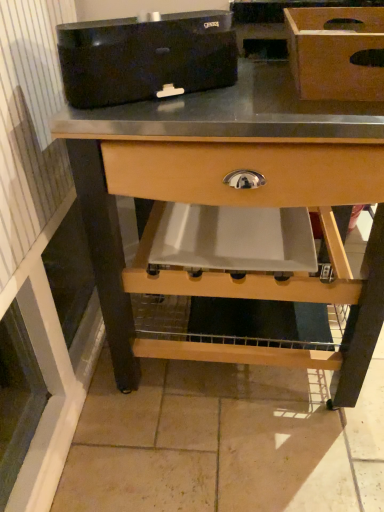
Measure the distance between black plastic toaster at upper center and camera.

black plastic toaster at upper center is 28.30 inches away from camera.

The height and width of the screenshot is (512, 384). Find the location of `black plastic toaster at upper center`. black plastic toaster at upper center is located at coordinates (146, 57).

You are a GUI agent. You are given a task and a screenshot of the screen. Output one action in this format:
    pyautogui.click(x=<x>, y=<y>)
    Task: Click on the wooden box at upper right
    
    Given the screenshot: What is the action you would take?
    [x=335, y=52]

From a real-world perspective, does black plastic toaster at upper center sit lower than wooden box at upper right?

Indeed, from a real-world perspective, black plastic toaster at upper center is positioned beneath wooden box at upper right.

Considering the points (64, 79) and (369, 11), which point is in front, point (64, 79) or point (369, 11)?

The point (64, 79) is closer to the camera.

Could you tell me if black plastic toaster at upper center is facing wooden box at upper right?

No, black plastic toaster at upper center is not turned towards wooden box at upper right.

Is black plastic toaster at upper center thinner than wooden box at upper right?

Correct, the width of black plastic toaster at upper center is less than that of wooden box at upper right.

Does wooden box at upper right lie behind black plastic toaster at upper center?

Yes, it is.

Can you confirm if wooden box at upper right is positioned to the left of black plastic toaster at upper center?

No.

In terms of size, does wooden box at upper right appear bigger or smaller than black plastic toaster at upper center?

In the image, wooden box at upper right appears to be larger than black plastic toaster at upper center.

Is black plastic toaster at upper center positioned behind natural wood table at center?

No, black plastic toaster at upper center is in front of natural wood table at center.

What's the angular difference between black plastic toaster at upper center and natural wood table at center's facing directions?

54.1 degrees separate the facing orientations of black plastic toaster at upper center and natural wood table at center.

Could you tell me if black plastic toaster at upper center is facing natural wood table at center?

No, black plastic toaster at upper center does not turn towards natural wood table at center.

Is black plastic toaster at upper center not close to natural wood table at center?

They are positioned close to each other.

From the image's perspective, relative to natural wood table at center, is wooden box at upper right above or below?

From the image's perspective, wooden box at upper right appears above natural wood table at center.

Is wooden box at upper right far from natural wood table at center?

That's not correct — wooden box at upper right is a little close to natural wood table at center.

Is wooden box at upper right positioned beyond the bounds of natural wood table at center?

wooden box at upper right lies outside natural wood table at center's area.

Looking at this image, is the position of wooden box at upper right less distant than that of natural wood table at center?

Yes, it is.

Is natural wood table at center situated inside black plastic toaster at upper center or outside?

natural wood table at center is not enclosed by black plastic toaster at upper center.

The image size is (384, 512). Find the location of `table that appears on the right of black plastic toaster at upper center`. table that appears on the right of black plastic toaster at upper center is located at coordinates (233, 206).

Is natural wood table at center wider or thinner than black plastic toaster at upper center?

Clearly, natural wood table at center has more width compared to black plastic toaster at upper center.

Measure the distance between natural wood table at center and black plastic toaster at upper center.

natural wood table at center and black plastic toaster at upper center are 10.04 inches apart from each other.

Which is more distant, [356,393] or [294,23]?

The point [356,393] is farther.

Which object is closer to the camera, natural wood table at center or wooden box at upper right?

wooden box at upper right.

Are natural wood table at center and wooden box at upper right making contact?

They are not placed beside each other.

Locate an element on the screen. This screenshot has height=512, width=384. box above the black plastic toaster at upper center (from the image's perspective) is located at coordinates (335, 52).

Where is `appliance that is below the wooden box at upper right (from the image's perspective)`? appliance that is below the wooden box at upper right (from the image's perspective) is located at coordinates (146, 57).

Based on the photo, estimate the real-world distances between objects in this image. Which object is further from wooden box at upper right, black plastic toaster at upper center or natural wood table at center?

Based on the image, natural wood table at center appears to be further to wooden box at upper right.

Which object lies nearer to the anchor point natural wood table at center, wooden box at upper right or black plastic toaster at upper center?

black plastic toaster at upper center.

When comparing their distances from black plastic toaster at upper center, does natural wood table at center or wooden box at upper right seem closer?

natural wood table at center.

When comparing their distances from wooden box at upper right, does natural wood table at center or black plastic toaster at upper center seem further?

natural wood table at center.

When comparing their distances from black plastic toaster at upper center, does wooden box at upper right or natural wood table at center seem closer?

The object closer to black plastic toaster at upper center is natural wood table at center.

Considering their positions, is black plastic toaster at upper center positioned further to natural wood table at center than wooden box at upper right?

wooden box at upper right.

Where is `appliance between wooden box at upper right and natural wood table at center in the vertical direction`? This screenshot has width=384, height=512. appliance between wooden box at upper right and natural wood table at center in the vertical direction is located at coordinates (146, 57).